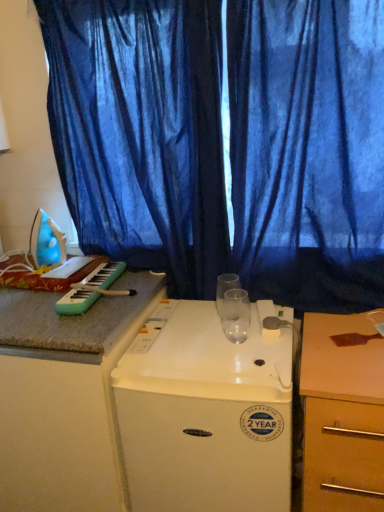
Locate an element on the screen. empty space that is ontop of white plastic refrigerator at center (from a real-world perspective) is located at coordinates (213, 335).